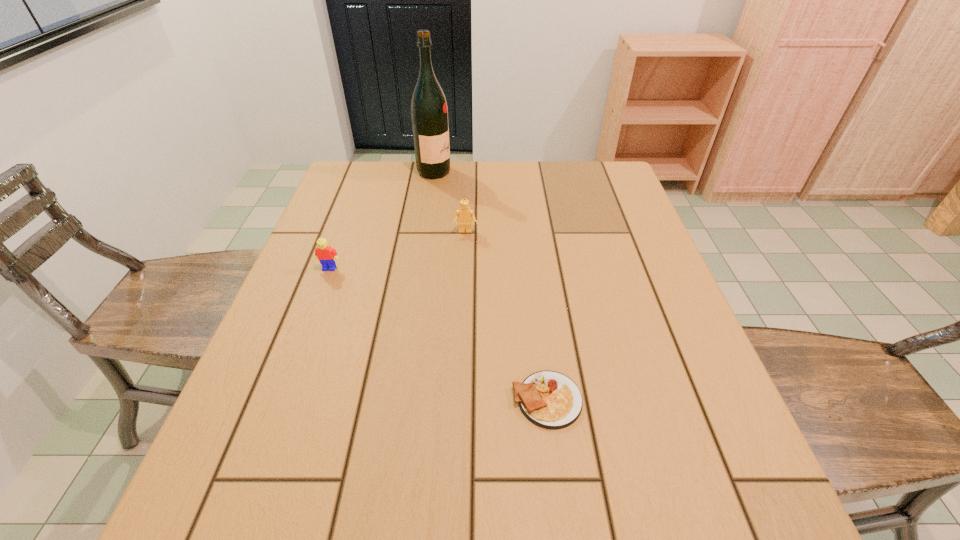
Locate an element on the screen. The height and width of the screenshot is (540, 960). liquor is located at coordinates (429, 113).

Find the location of a particular element. This screenshot has height=540, width=960. the farthest object is located at coordinates (429, 113).

Locate an element on the screen. the farther Lego is located at coordinates (464, 215).

Image resolution: width=960 pixels, height=540 pixels. Identify the location of the third object from left to right. (464, 215).

Find the location of a particular element. the second nearest object is located at coordinates (326, 255).

Locate an element on the screen. The width and height of the screenshot is (960, 540). the leftmost object is located at coordinates (326, 255).

Locate an element on the screen. This screenshot has width=960, height=540. the nearest object is located at coordinates (551, 400).

In order to click on omelet in this screenshot , I will do `click(551, 400)`.

Identify the location of free spot located on the front-facing side of the liquor. (560, 172).

The image size is (960, 540). Find the location of `free location located on the face of the third object from left to right`. free location located on the face of the third object from left to right is located at coordinates (461, 346).